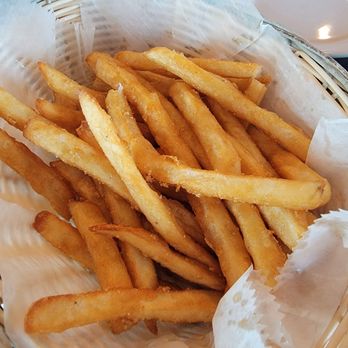
Where is `window`? window is located at coordinates (343, 62).